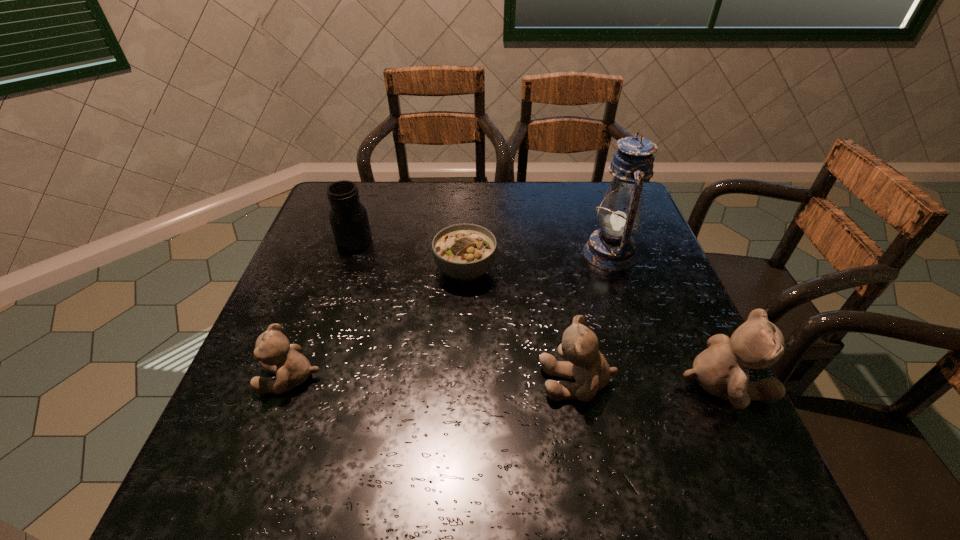
Find the location of `lantern that is at the right edge`. lantern that is at the right edge is located at coordinates (612, 248).

The height and width of the screenshot is (540, 960). In order to click on object at the near left corner in this screenshot , I will do (275, 354).

Where is `object that is at the near right corner`? object that is at the near right corner is located at coordinates (722, 370).

Identify the location of blank area at the far edge. This screenshot has width=960, height=540. (387, 202).

Locate an element on the screen. free space at the left edge of the desktop is located at coordinates (335, 297).

Where is `vacant space at the right edge of the desktop`? The height and width of the screenshot is (540, 960). vacant space at the right edge of the desktop is located at coordinates (656, 369).

You are a GUI agent. You are given a task and a screenshot of the screen. Output one action in this format:
    pyautogui.click(x=<x>, y=<y>)
    Task: Click on the vacant space at the near left corner of the desktop
    The image size is (960, 540).
    Given the screenshot: What is the action you would take?
    pyautogui.click(x=257, y=436)

Locate an element on the screen. This screenshot has width=960, height=540. vacant space that's between the soup bowl and the jar is located at coordinates (410, 255).

The image size is (960, 540). I want to click on free space that is in between the second shortest object and the second teddy bear from left to right, so click(x=434, y=380).

At what (x,y) coordinates should I click in order to perform the action: click on vacant area that lies between the jar and the fifth tallest object. Please return your answer as a coordinate pair (x, y). This screenshot has height=540, width=960. Looking at the image, I should click on (323, 309).